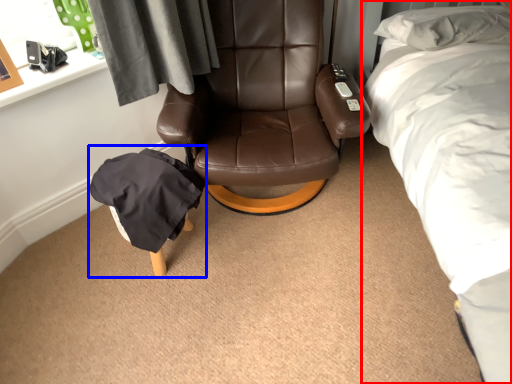
Question: Which object appears closest to the camera in this image, bed (highlighted by a red box) or bean bag chair (highlighted by a blue box)?

Choices:
 (A) bed
 (B) bean bag chair

Answer: (A)